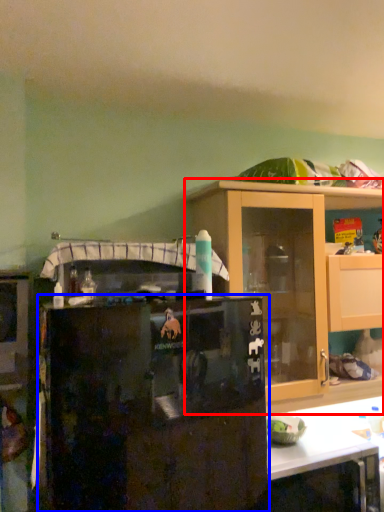
Question: Which object is closer to the camera taking this photo, cabinetry (highlighted by a red box) or refrigerator (highlighted by a blue box)?

Choices:
 (A) cabinetry
 (B) refrigerator

Answer: (B)